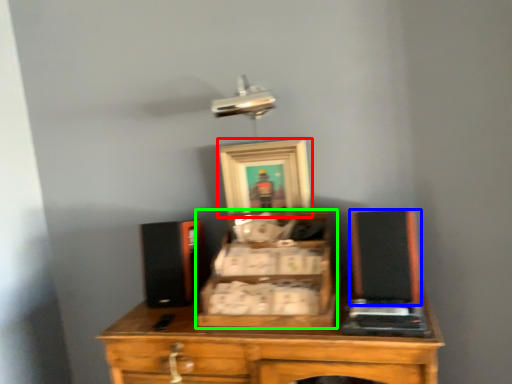
Question: Based on their relative distances, which object is nearer to picture frame (highlighted by a red box)? Choose from wide (highlighted by a blue box) and drawer (highlighted by a green box).

Choices:
 (A) wide
 (B) drawer

Answer: (B)